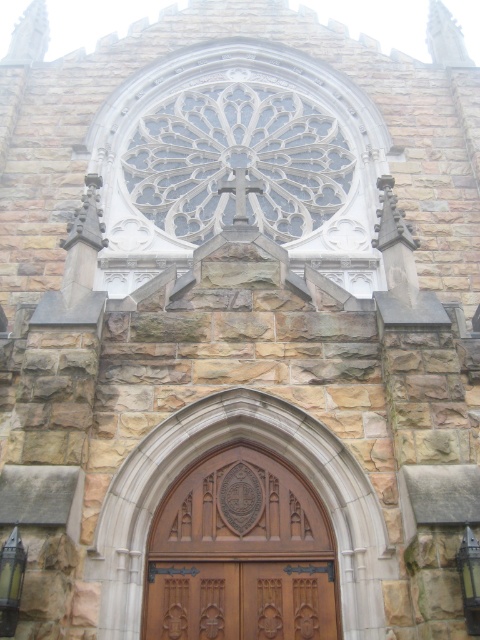
You are standing in front of the church and want to enter through the brown wood door at center. You notice a clear glass cross at upper center above the door. Which object is closer to you as you face the church?

The brown wood door at center is closer to the viewer than the clear glass cross at upper center.

You are standing in front of the church and want to enter through the door. Which door should you approach first, the brown wood door at center or the brown wooden door at center?

You should approach the brown wood door at center first because it is closer to you than the brown wooden door at center, which is further away.